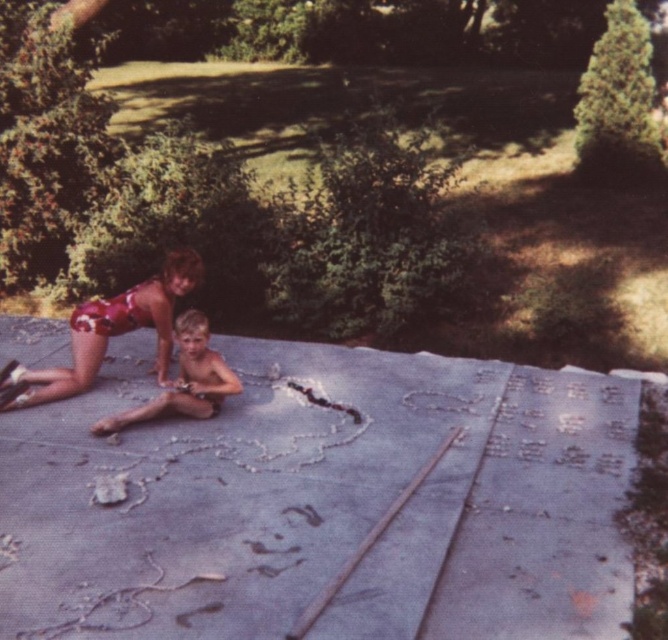
Is point (180, 269) in front of point (170, 403)?

No.

Who is positioned more to the right, shiny metallic bikini top at lower left or smooth skin child at center?

From the viewer's perspective, smooth skin child at center appears more on the right side.

What do you see at coordinates (114, 330) in the screenshot? I see `shiny metallic bikini top at lower left` at bounding box center [114, 330].

Where is `shiny metallic bikini top at lower left`? This screenshot has width=668, height=640. shiny metallic bikini top at lower left is located at coordinates (114, 330).